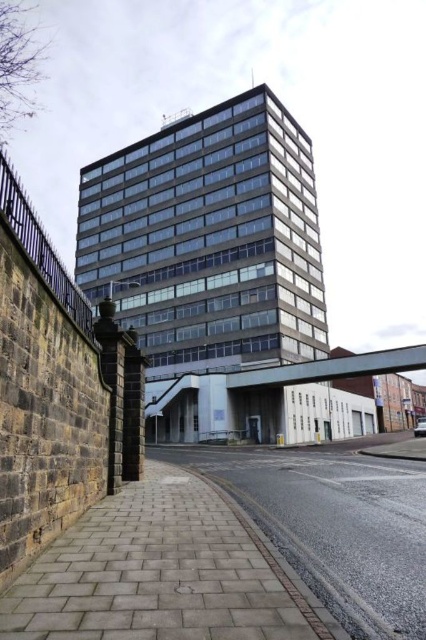
Question: Can you confirm if gray concrete pavement at lower left is wider than paved brick sidewalk at lower center?

Choices:
 (A) no
 (B) yes

Answer: (A)

Question: Which point is farther to the camera?

Choices:
 (A) (108, 595)
 (B) (256, 488)

Answer: (B)

Question: Can you confirm if gray concrete pavement at lower left is positioned above paved brick sidewalk at lower center?

Choices:
 (A) no
 (B) yes

Answer: (B)

Question: Is gray concrete pavement at lower left to the right of paved brick sidewalk at lower center from the viewer's perspective?

Choices:
 (A) yes
 (B) no

Answer: (B)

Question: Which point appears closest to the camera in this image?

Choices:
 (A) (264, 588)
 (B) (389, 492)

Answer: (A)